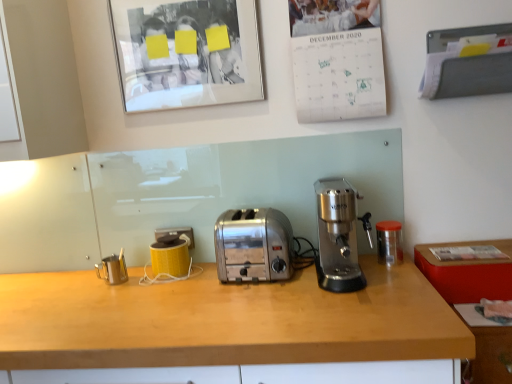
Locate an element on the screen. This screenshot has width=512, height=384. vacant region to the left of brushed metal milk frother at left, which appears as the first appliance when viewed from the left is located at coordinates (69, 281).